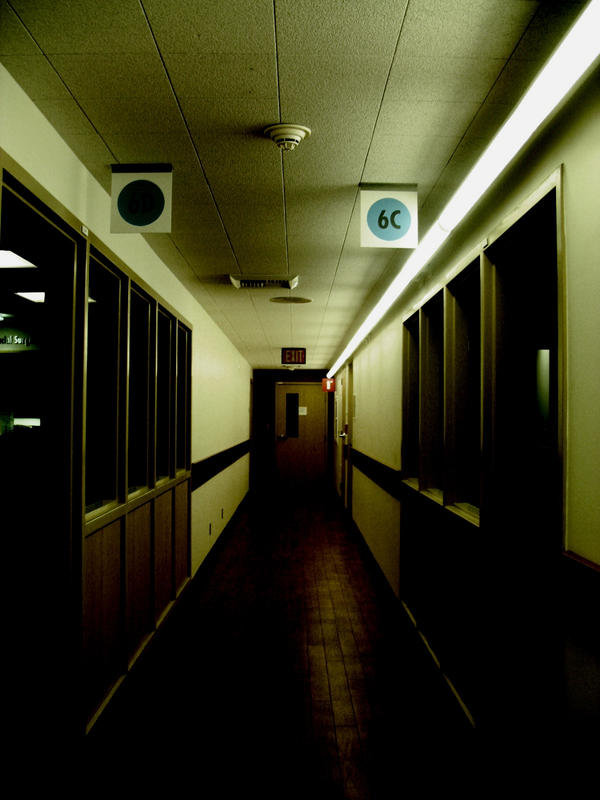
Locate an element on the screen. This screenshot has width=600, height=800. white wall is located at coordinates (377, 394).